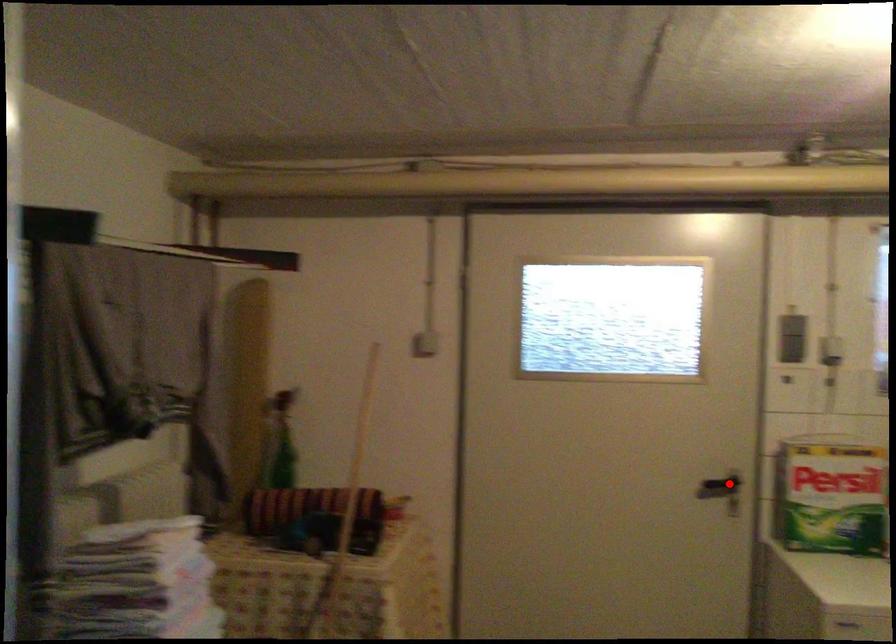
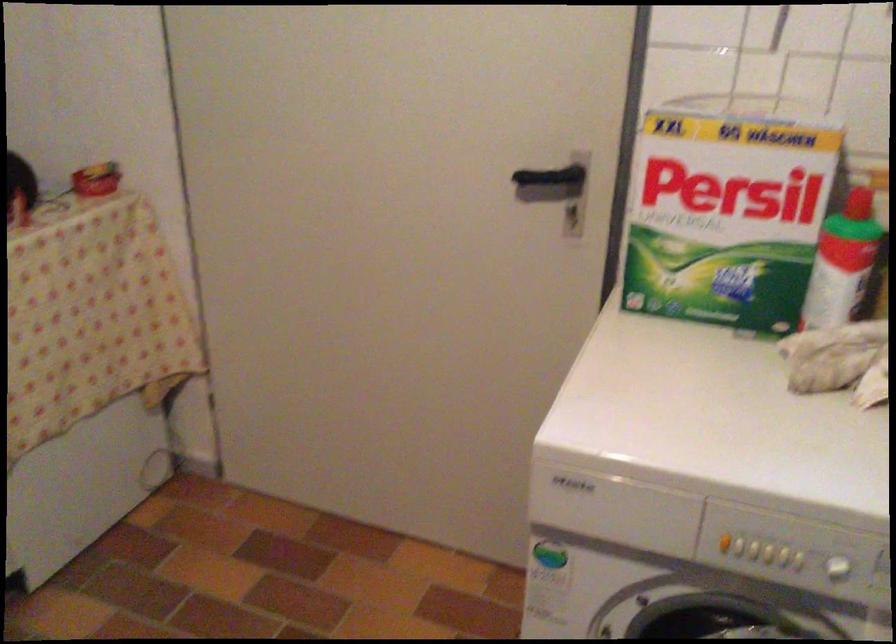
Question: A red point is marked in image1. In image2, is the corresponding 3D point closer to the camera or farther? Reply with the corresponding letter.

Choices:
 (A) The corresponding 3D point is closer.
 (B) The corresponding 3D point is farther.

Answer: (A)